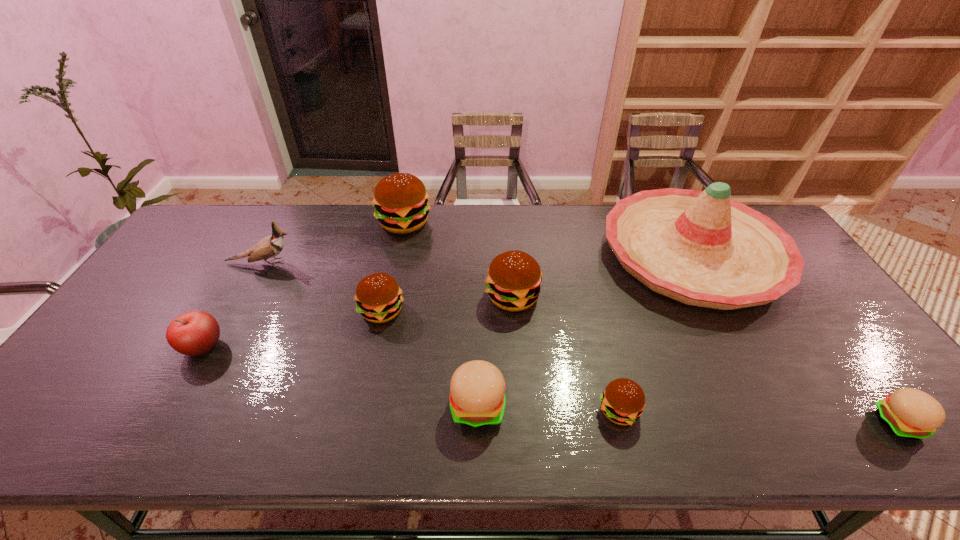
This screenshot has width=960, height=540. I want to click on vacant area that lies between the smallest brown hamburger and the second smallest brown hamburger, so click(x=500, y=361).

The width and height of the screenshot is (960, 540). I want to click on unoccupied position between the red sombrero and the sixth farthest object, so click(x=447, y=301).

Identify the location of free space between the smaller beige hamburger and the sombrero. Image resolution: width=960 pixels, height=540 pixels. (796, 339).

Locate an element on the screen. free point between the fourth nearest object and the bigger beige hamburger is located at coordinates (340, 376).

Identify the location of object that stands as the sixth closest to the rightmost brown hamburger. (400, 200).

Choose which object is the eighth nearest neighbor to the second hamburger from right to left. Please provide its 2D coordinates. Your answer should be formatted as a tuple, i.e. [(x, y)], where the tuple contains the x and y coordinates of a point satisfying the conditions above.

[(268, 247)]

Find the location of `hamburger that can be found as the third closest to the third brown hamburger from left to right`. hamburger that can be found as the third closest to the third brown hamburger from left to right is located at coordinates (623, 400).

This screenshot has height=540, width=960. I want to click on the second closest hamburger to the left beige hamburger, so click(x=623, y=400).

Locate which brown hamburger ranks in proximity to the second brown hamburger from right to left. Please provide its 2D coordinates. Your answer should be formatted as a tuple, i.e. [(x, y)], where the tuple contains the x and y coordinates of a point satisfying the conditions above.

[(378, 296)]

Locate an element on the screen. This screenshot has height=540, width=960. the third closest brown hamburger to the third brown hamburger from left to right is located at coordinates (400, 200).